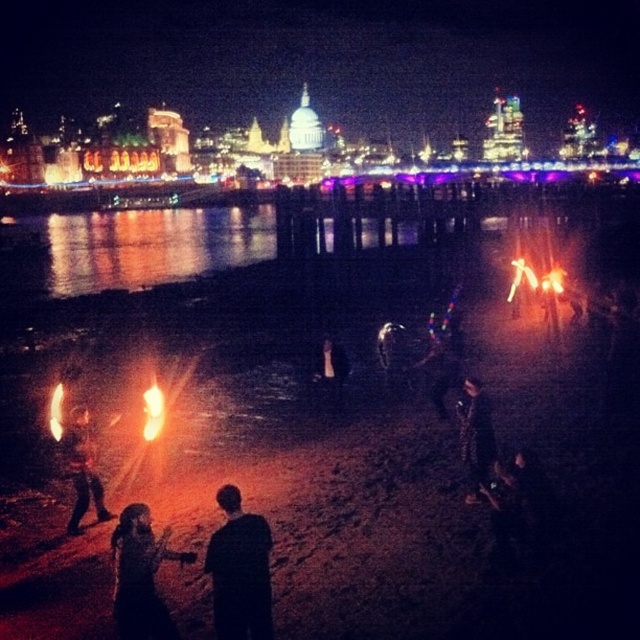
Question: Based on their relative distances, which object is nearer to the shiny metallic fire at lower left?

Choices:
 (A) dark fabric jacket at center
 (B) orange flame at center

Answer: (B)

Question: Among these objects, which one is nearest to the camera?

Choices:
 (A) orange flame at center
 (B) orange flame at lower left

Answer: (B)

Question: Considering the relative positions of black matte jacket at center and dark fabric dress at lower center in the image provided, where is black matte jacket at center located with respect to dark fabric dress at lower center?

Choices:
 (A) left
 (B) right

Answer: (B)

Question: Can you confirm if dark fabric dress at lower center is positioned to the left of shiny metallic fire at lower left?

Choices:
 (A) no
 (B) yes

Answer: (A)

Question: Considering the relative positions of reflective glass water at center and black matte jacket at center in the image provided, where is reflective glass water at center located with respect to black matte jacket at center?

Choices:
 (A) right
 (B) left

Answer: (B)

Question: Based on their relative distances, which object is farther from the dark fabric jacket at center?

Choices:
 (A) black matte jacket at center
 (B) orange flame at lower left
 (C) dark fabric dress at lower center

Answer: (B)